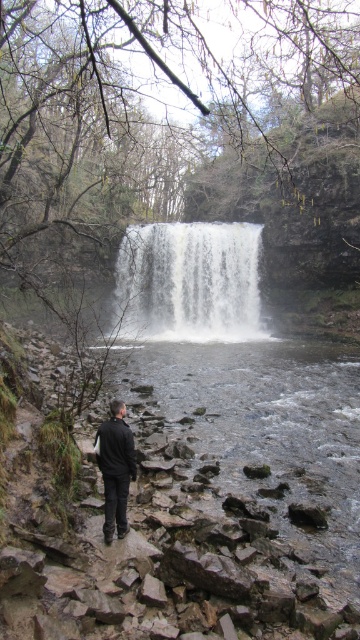
You are a photographer planning to capture the waterfall scene. You want to ensure that both the white textured water at center and the black matte jacket at center are clearly visible in your photo. Given that the water is larger in the frame, how should you adjust your composition to balance their visibility?

Since the white textured water at center is larger than the black matte jacket at center, you can position the jacket closer to the water or use a wider aperture to keep both in focus while ensuring the larger water area doesn t overpower the jacket.

You are a photographer trying to capture the waterfall scene. You notice the white textured water at center and the black matte jacket at center. Which object is located above the other?

The white textured water at center is positioned over the black matte jacket at center, meaning it is above the jacket.